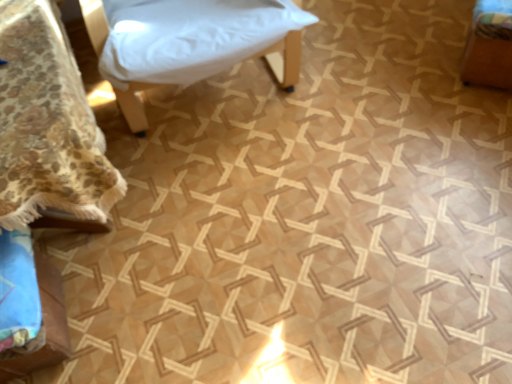
Question: Considering the positions of white fabric cushion at upper center, which is counted as the second furniture, starting from the right, and floral fabric bedspread at lower left, which ranks as the first furniture in left-to-right order, in the image, is white fabric cushion at upper center, which is counted as the second furniture, starting from the right, bigger or smaller than floral fabric bedspread at lower left, which ranks as the first furniture in left-to-right order,?

Choices:
 (A) big
 (B) small

Answer: (A)

Question: Would you say white fabric cushion at upper center, acting as the third furniture starting from the left, is inside or outside floral fabric bedspread at lower left, which ranks as the first furniture in left-to-right order?

Choices:
 (A) inside
 (B) outside

Answer: (B)

Question: Estimate the real-world distances between objects in this image. Which object is farther from the wooden box at right, acting as the 4th furniture starting from the left?

Choices:
 (A) white fabric cushion at upper center, acting as the third furniture starting from the left
 (B) blue fabric cushion at lower left, the 3th furniture from the right
 (C) floral fabric bedspread at lower left, arranged as the fourth furniture when viewed from the right

Answer: (B)

Question: Which of these objects is positioned farthest from the white fabric cushion at upper center, which is counted as the second furniture, starting from the right?

Choices:
 (A) floral fabric bedspread at lower left, which ranks as the first furniture in left-to-right order
 (B) blue fabric cushion at lower left, the 3th furniture from the right
 (C) wooden box at right, which appears as the first furniture when viewed from the right

Answer: (C)